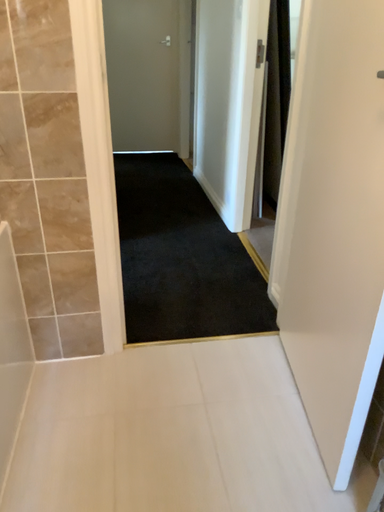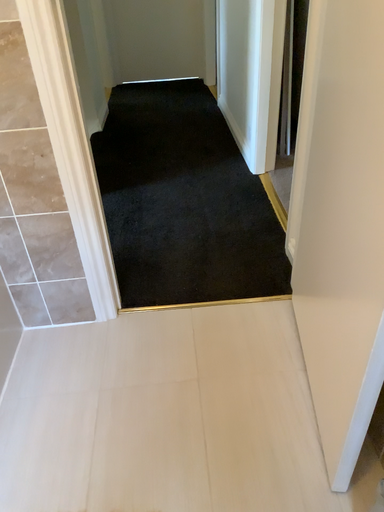
Question: Which way did the camera rotate in the video?

Choices:
 (A) rotated downward
 (B) rotated upward

Answer: (A)